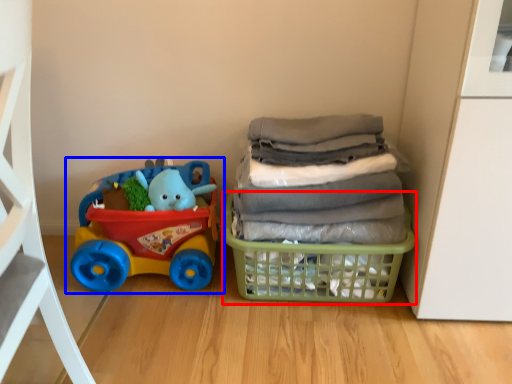
Question: Among these objects, which one is farthest to the camera, basket (highlighted by a red box) or toy (highlighted by a blue box)?

Choices:
 (A) basket
 (B) toy

Answer: (B)